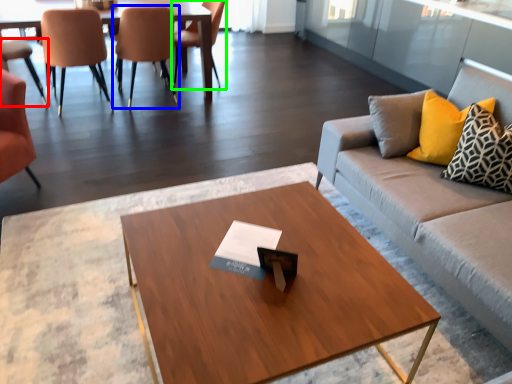
Question: Which object is the closest to the chair (highlighted by a red box)? Choose among these: chair (highlighted by a blue box) or chair (highlighted by a green box).

Choices:
 (A) chair
 (B) chair

Answer: (A)